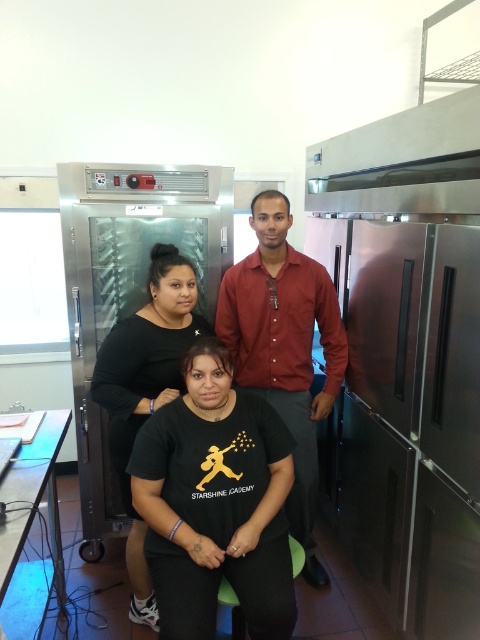
You are standing in the commercial kitchen and need to move from the point at coordinates point (286, 358) to the point at coordinates point (178, 394). Which direction should you move to reach your destination?

You should move forward because point (286, 358) is behind point (178, 394), so moving forward from point (286, 358) will bring you closer to point (178, 394).

Based on the scene description, which object is taller between the matte red shirt at center and the black matte dress at center?

The matte red shirt at center is much taller than the black matte dress at center.

What is the color of the shirt at the point with coordinates (285, 348)?

The point at coordinates (285, 348) is on a matte red shirt at center.